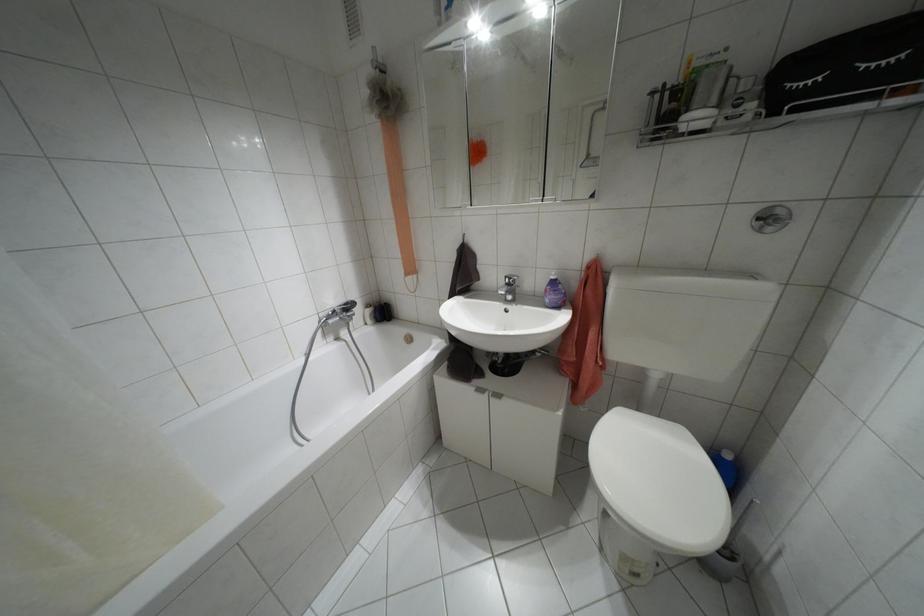
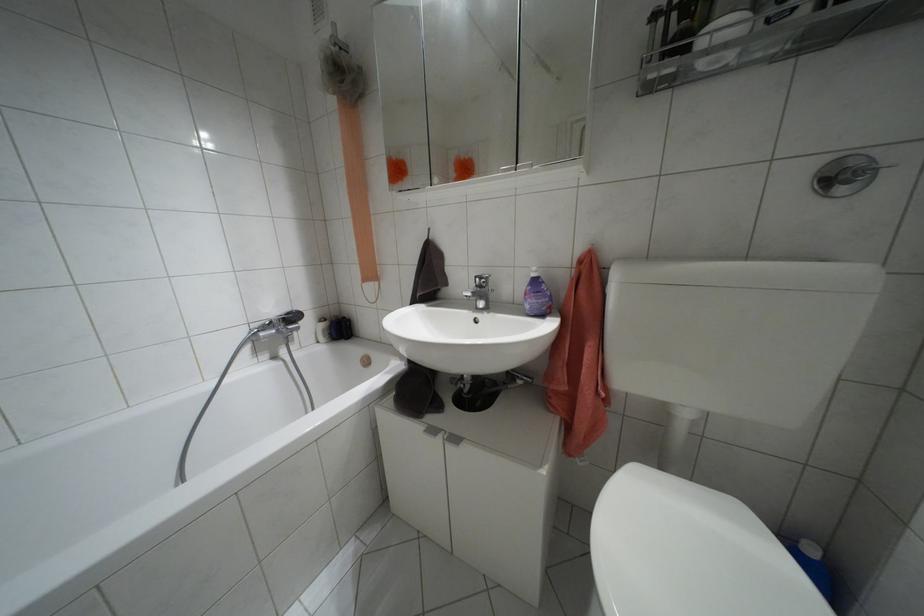
Where in the second image is the point corresponding to [345,304] from the first image?

(286, 313)